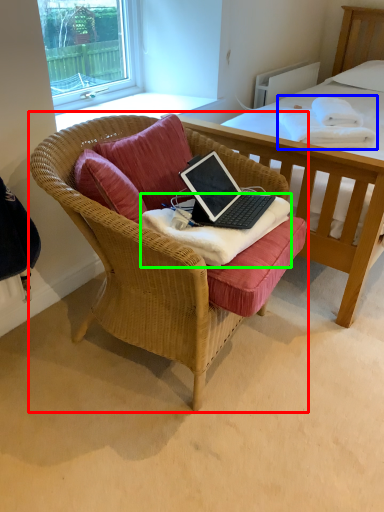
Question: Based on their relative distances, which object is farther from chair (highlighted by a red box)? Choose from blanket (highlighted by a blue box) and blanket (highlighted by a green box).

Choices:
 (A) blanket
 (B) blanket

Answer: (A)